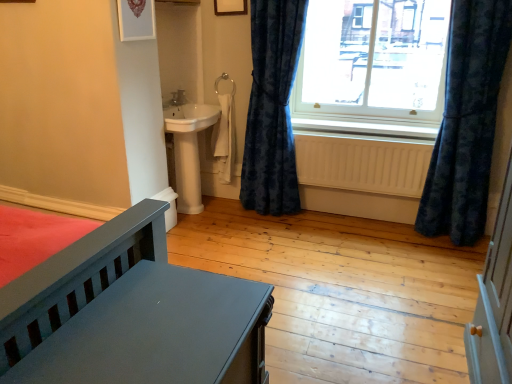
Question: Is matte gray bed at lower left at the right side of transparent glass window at upper right?

Choices:
 (A) yes
 (B) no

Answer: (B)

Question: From a real-world perspective, is matte gray bed at lower left beneath transparent glass window at upper right?

Choices:
 (A) no
 (B) yes

Answer: (B)

Question: Is matte gray bed at lower left oriented towards transparent glass window at upper right?

Choices:
 (A) no
 (B) yes

Answer: (A)

Question: From the image's perspective, is matte gray bed at lower left located beneath transparent glass window at upper right?

Choices:
 (A) yes
 (B) no

Answer: (A)

Question: Would you say matte gray bed at lower left contains transparent glass window at upper right?

Choices:
 (A) yes
 (B) no

Answer: (B)

Question: From the image's perspective, is matte gray bed at lower left located above or below velvet blue curtain at right, positioned as the first curtain in left-to-right order?

Choices:
 (A) below
 (B) above

Answer: (A)

Question: From a real-world perspective, is matte gray bed at lower left physically located above or below velvet blue curtain at right, which ranks as the second curtain in right-to-left order?

Choices:
 (A) above
 (B) below

Answer: (B)

Question: In the image, is matte gray bed at lower left on the left side or the right side of velvet blue curtain at right, positioned as the first curtain in left-to-right order?

Choices:
 (A) left
 (B) right

Answer: (A)

Question: Considering their positions, is matte gray bed at lower left located in front of or behind velvet blue curtain at right, which ranks as the second curtain in right-to-left order?

Choices:
 (A) front
 (B) behind

Answer: (A)

Question: From their relative heights in the image, would you say velvet dark blue curtain at right, acting as the 2th curtain starting from the left, is taller or shorter than matte gray bed at lower left?

Choices:
 (A) short
 (B) tall

Answer: (B)

Question: Is velvet dark blue curtain at right, acting as the 2th curtain starting from the left, to the left or to the right of matte gray bed at lower left in the image?

Choices:
 (A) left
 (B) right

Answer: (B)

Question: Which is correct: velvet dark blue curtain at right, which appears as the first curtain when viewed from the right, is inside matte gray bed at lower left, or outside of it?

Choices:
 (A) inside
 (B) outside

Answer: (B)

Question: From a real-world perspective, is velvet dark blue curtain at right, which appears as the first curtain when viewed from the right, physically located above or below matte gray bed at lower left?

Choices:
 (A) below
 (B) above

Answer: (B)

Question: Is beige wooden radiator at lower center situated inside velvet blue curtain at right, which ranks as the second curtain in right-to-left order, or outside?

Choices:
 (A) outside
 (B) inside

Answer: (A)

Question: Considering their positions, is beige wooden radiator at lower center located in front of or behind velvet blue curtain at right, positioned as the first curtain in left-to-right order?

Choices:
 (A) behind
 (B) front

Answer: (A)